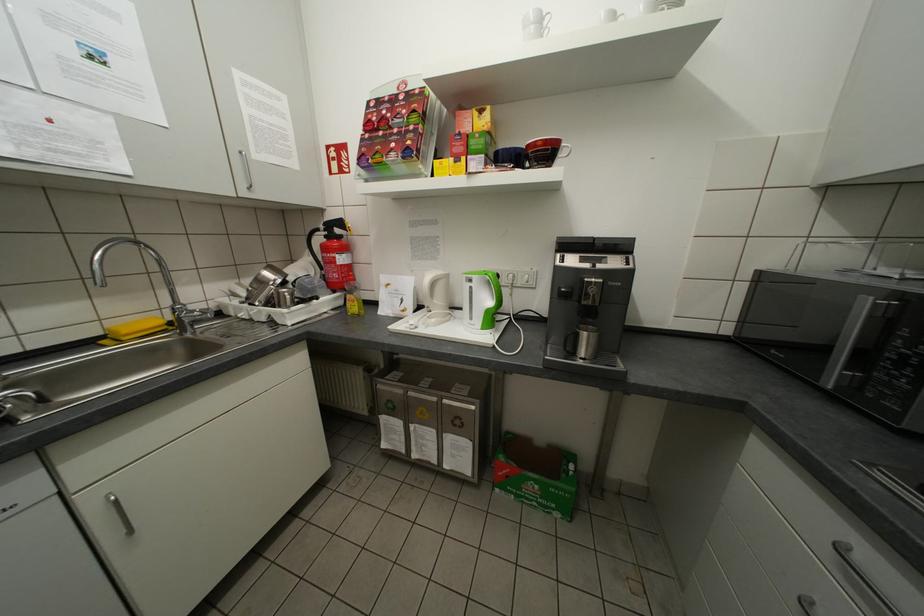
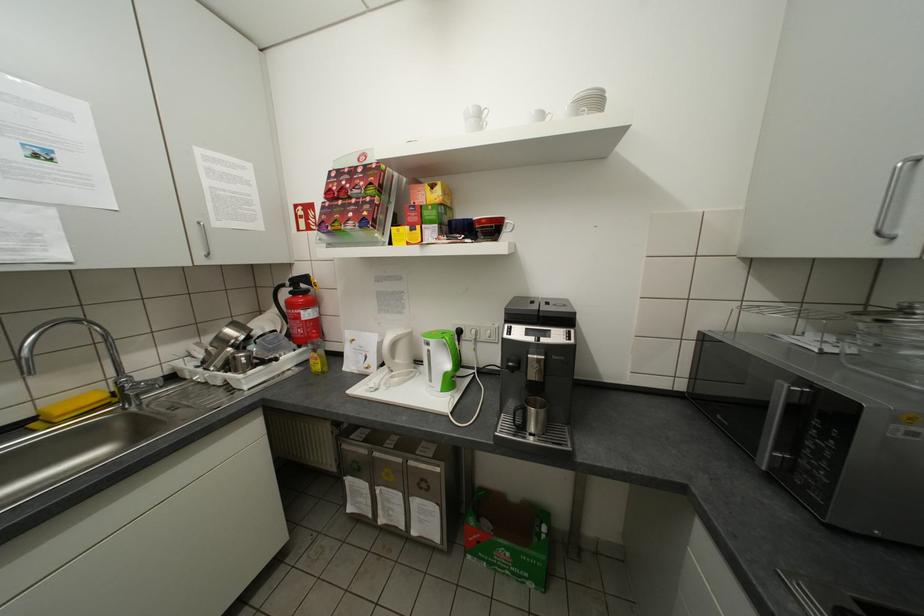
Locate, in the second image, the point that corresponds to [251,185] in the first image.

(209, 253)